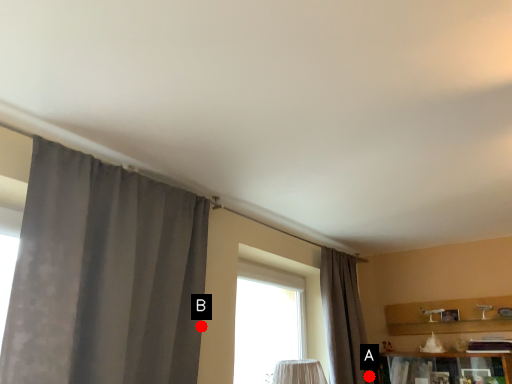
Question: Two points are circled on the image, labeled by A and B beside each circle. Which point is farther to the camera?

Choices:
 (A) A is further
 (B) B is further

Answer: (A)